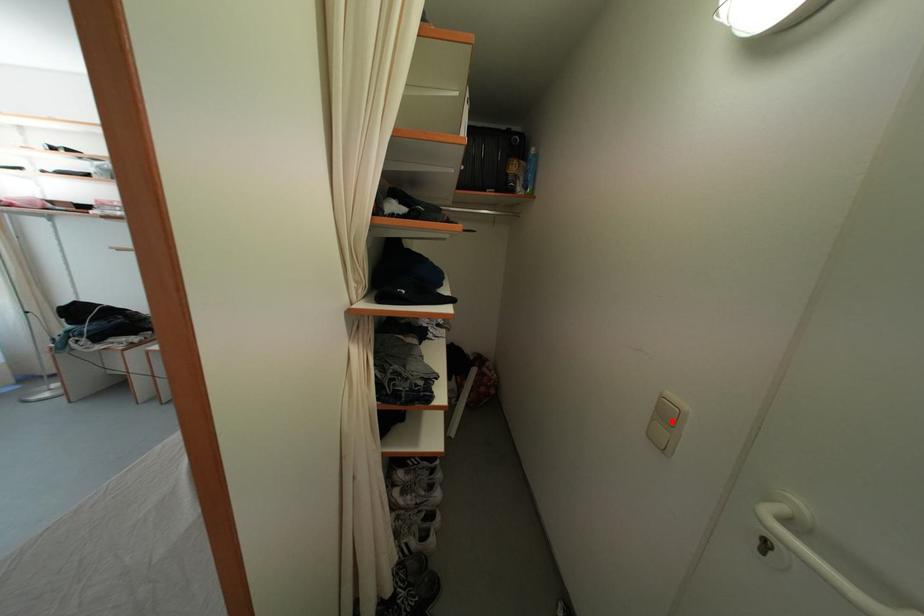
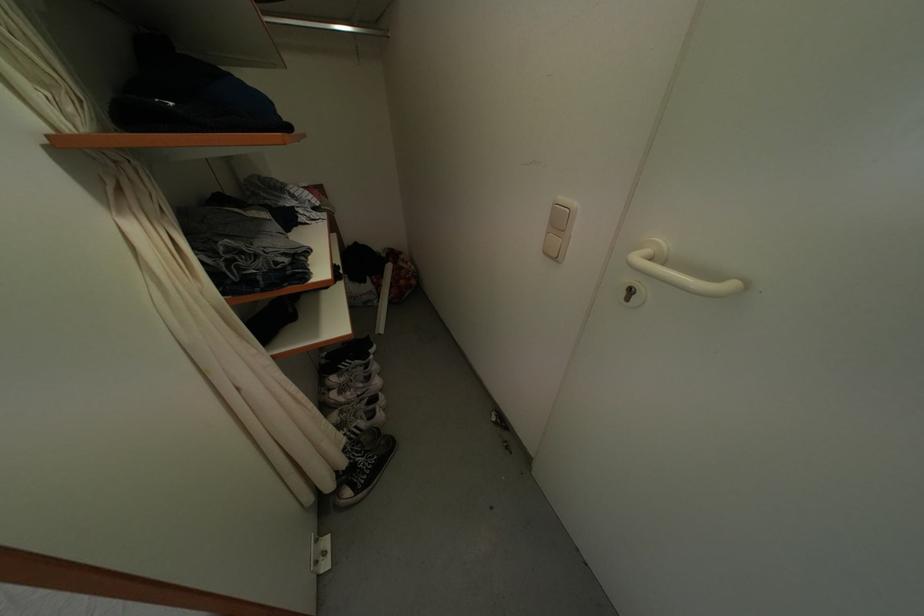
Where in the second image is the point corresponding to the highlighted location from the first image?

(565, 228)